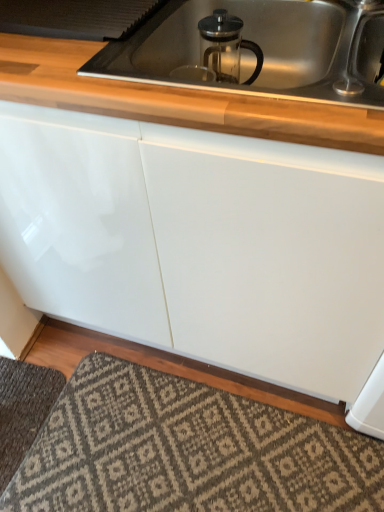
This screenshot has height=512, width=384. What do you see at coordinates (364, 51) in the screenshot?
I see `satin nickel faucet at upper right` at bounding box center [364, 51].

Find the location of a particular element. The height and width of the screenshot is (512, 384). patterned carpet at lower center, which appears as the 2th doormat when viewed from the left is located at coordinates (186, 451).

Identify the location of dark gray textured rug at lower left, which appears as the 1th doormat when viewed from the left. (23, 409).

What is the approximate width of clear glass french press at upper center?

clear glass french press at upper center is 4.42 inches wide.

Where is `satin nickel faucet at upper right`? satin nickel faucet at upper right is located at coordinates (364, 51).

Looking at their sizes, would you say satin nickel faucet at upper right is wider or thinner than clear glass french press at upper center?

satin nickel faucet at upper right is wider than clear glass french press at upper center.

This screenshot has width=384, height=512. What are the coordinates of `faucet above the clear glass french press at upper center (from a real-world perspective)` in the screenshot? It's located at (364, 51).

From a real-world perspective, between satin nickel faucet at upper right and clear glass french press at upper center, who is vertically higher?

satin nickel faucet at upper right, from a real-world perspective.

Does point (377, 27) come behind point (239, 54)?

No.

Considering the points (39, 368) and (170, 489), which point is behind, point (39, 368) or point (170, 489)?

The point (39, 368) is behind.

Considering the sizes of objects dark gray textured rug at lower left, which appears as the 1th doormat when viewed from the left, and patterned carpet at lower center, placed as the 1th doormat when sorted from right to left, in the image provided, who is thinner, dark gray textured rug at lower left, which appears as the 1th doormat when viewed from the left, or patterned carpet at lower center, placed as the 1th doormat when sorted from right to left,?

Thinner between the two is dark gray textured rug at lower left, which appears as the 1th doormat when viewed from the left.

Considering the positions of objects dark gray textured rug at lower left, the 2th doormat from the right, and patterned carpet at lower center, which appears as the 2th doormat when viewed from the left, in the image provided, who is more to the left, dark gray textured rug at lower left, the 2th doormat from the right, or patterned carpet at lower center, which appears as the 2th doormat when viewed from the left,?

dark gray textured rug at lower left, the 2th doormat from the right.

Based on their positions, is clear glass french press at upper center located to the left or right of dark gray textured rug at lower left, which appears as the 1th doormat when viewed from the left?

clear glass french press at upper center is to the right of dark gray textured rug at lower left, which appears as the 1th doormat when viewed from the left.

Does point (232, 69) come farther from viewer compared to point (4, 359)?

No.

From a real-world perspective, is clear glass french press at upper center physically located above or below dark gray textured rug at lower left, the 2th doormat from the right?

clear glass french press at upper center is above dark gray textured rug at lower left, the 2th doormat from the right.

Would you say patterned carpet at lower center, placed as the 1th doormat when sorted from right to left, is to the left or to the right of clear glass french press at upper center in the picture?

From the image, it's evident that patterned carpet at lower center, placed as the 1th doormat when sorted from right to left, is to the left of clear glass french press at upper center.

Consider the image. Is patterned carpet at lower center, placed as the 1th doormat when sorted from right to left, positioned far away from clear glass french press at upper center?

No, patterned carpet at lower center, placed as the 1th doormat when sorted from right to left, is not far from clear glass french press at upper center.

Is point (287, 426) positioned in front of point (262, 59)?

That is False.

Can you confirm if patterned carpet at lower center, which appears as the 2th doormat when viewed from the left, is shorter than clear glass french press at upper center?

Yes.

Which of these two, white glossy countertop at upper center or dark gray textured rug at lower left, which appears as the 1th doormat when viewed from the left, stands taller?

white glossy countertop at upper center.

Considering the relative sizes of white glossy countertop at upper center and dark gray textured rug at lower left, the 2th doormat from the right, in the image provided, is white glossy countertop at upper center bigger than dark gray textured rug at lower left, the 2th doormat from the right,?

Yes.

Which object is thinner, white glossy countertop at upper center or dark gray textured rug at lower left, the 2th doormat from the right?

With smaller width is dark gray textured rug at lower left, the 2th doormat from the right.

Considering the sizes of objects dark gray textured rug at lower left, the 2th doormat from the right, and satin nickel faucet at upper right in the image provided, who is wider, dark gray textured rug at lower left, the 2th doormat from the right, or satin nickel faucet at upper right?

dark gray textured rug at lower left, the 2th doormat from the right.

How many degrees apart are the facing directions of dark gray textured rug at lower left, the 2th doormat from the right, and satin nickel faucet at upper right?

The angle between the facing direction of dark gray textured rug at lower left, the 2th doormat from the right, and the facing direction of satin nickel faucet at upper right is 91.2 degrees.

Which is farther, (5, 388) or (369, 25)?

Point (5, 388)

Is dark gray textured rug at lower left, which appears as the 1th doormat when viewed from the left, situated inside satin nickel faucet at upper right or outside?

dark gray textured rug at lower left, which appears as the 1th doormat when viewed from the left, is not inside satin nickel faucet at upper right, it's outside.

In the scene shown: Is clear glass french press at upper center facing towards satin nickel faucet at upper right?

No, clear glass french press at upper center is not oriented towards satin nickel faucet at upper right.

Considering the positions of objects clear glass french press at upper center and satin nickel faucet at upper right in the image provided, who is behind, clear glass french press at upper center or satin nickel faucet at upper right?

clear glass french press at upper center is further from the camera.

Is clear glass french press at upper center positioned beyond the bounds of satin nickel faucet at upper right?

Indeed, clear glass french press at upper center is completely outside satin nickel faucet at upper right.

Does clear glass french press at upper center appear on the left side of satin nickel faucet at upper right?

Correct, you'll find clear glass french press at upper center to the left of satin nickel faucet at upper right.

The height and width of the screenshot is (512, 384). What are the coordinates of `appliance behind the satin nickel faucet at upper right` in the screenshot? It's located at (226, 47).

Locate an element on the screen. doormat that appears above the patterned carpet at lower center, placed as the 1th doormat when sorted from right to left (from the image's perspective) is located at coordinates (23, 409).

Looking at the image, which one is located closer to patterned carpet at lower center, placed as the 1th doormat when sorted from right to left, clear glass french press at upper center or dark gray textured rug at lower left, which appears as the 1th doormat when viewed from the left?

dark gray textured rug at lower left, which appears as the 1th doormat when viewed from the left, is positioned closer to the anchor patterned carpet at lower center, placed as the 1th doormat when sorted from right to left.

Estimate the real-world distances between objects in this image. Which object is closer to dark gray textured rug at lower left, which appears as the 1th doormat when viewed from the left, white glossy countertop at upper center or satin nickel faucet at upper right?

white glossy countertop at upper center is closer to dark gray textured rug at lower left, which appears as the 1th doormat when viewed from the left.

Looking at the image, which one is located closer to white glossy countertop at upper center, dark gray textured rug at lower left, the 2th doormat from the right, or patterned carpet at lower center, placed as the 1th doormat when sorted from right to left?

patterned carpet at lower center, placed as the 1th doormat when sorted from right to left.

Looking at the image, which one is located further to patterned carpet at lower center, placed as the 1th doormat when sorted from right to left, white glossy countertop at upper center or dark gray textured rug at lower left, the 2th doormat from the right?

white glossy countertop at upper center.

When comparing their distances from dark gray textured rug at lower left, which appears as the 1th doormat when viewed from the left, does clear glass french press at upper center or white glossy countertop at upper center seem closer?

white glossy countertop at upper center.

Looking at this image, when comparing their distances from dark gray textured rug at lower left, the 2th doormat from the right, does white glossy countertop at upper center or clear glass french press at upper center seem further?

clear glass french press at upper center is further to dark gray textured rug at lower left, the 2th doormat from the right.

Looking at the image, which one is located further to satin nickel faucet at upper right, patterned carpet at lower center, placed as the 1th doormat when sorted from right to left, or dark gray textured rug at lower left, which appears as the 1th doormat when viewed from the left?

Based on the image, dark gray textured rug at lower left, which appears as the 1th doormat when viewed from the left, appears to be further to satin nickel faucet at upper right.

Looking at the image, which one is located closer to white glossy countertop at upper center, patterned carpet at lower center, placed as the 1th doormat when sorted from right to left, or dark gray textured rug at lower left, the 2th doormat from the right?

patterned carpet at lower center, placed as the 1th doormat when sorted from right to left, lies closer to white glossy countertop at upper center than the other object.

This screenshot has width=384, height=512. I want to click on doormat that lies between clear glass french press at upper center and patterned carpet at lower center, which appears as the 2th doormat when viewed from the left, from top to bottom, so click(23, 409).

Where is `countertop between clear glass french press at upper center and satin nickel faucet at upper right from left to right`? Image resolution: width=384 pixels, height=512 pixels. countertop between clear glass french press at upper center and satin nickel faucet at upper right from left to right is located at coordinates (175, 99).

Image resolution: width=384 pixels, height=512 pixels. Identify the location of countertop between clear glass french press at upper center and patterned carpet at lower center, placed as the 1th doormat when sorted from right to left, in the up-down direction. (175, 99).

Identify the location of countertop situated between dark gray textured rug at lower left, the 2th doormat from the right, and satin nickel faucet at upper right from left to right. (175, 99).